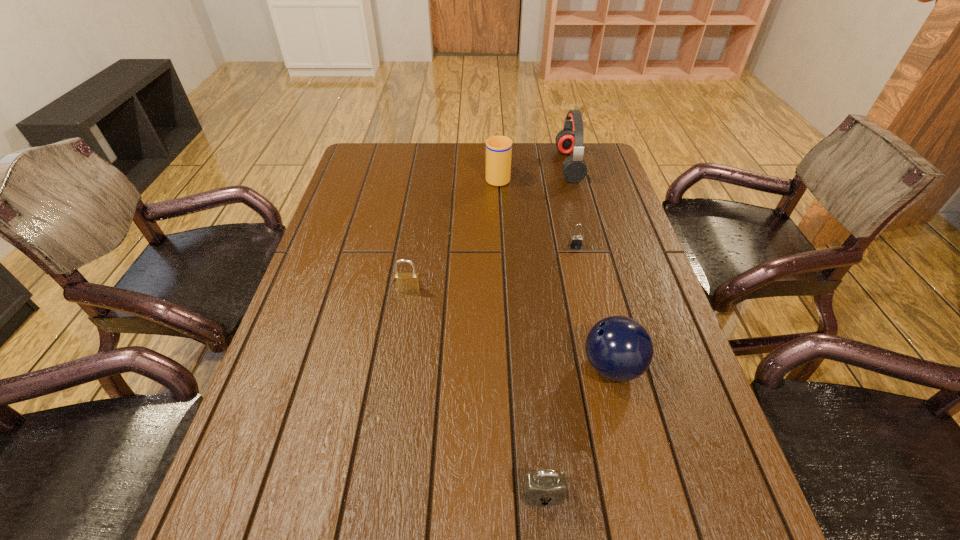
Where is `padlock that is the third closest to the bowling ball`? padlock that is the third closest to the bowling ball is located at coordinates (404, 282).

The width and height of the screenshot is (960, 540). In order to click on padlock that stands as the second closest to the fourth farthest object in this screenshot , I will do `click(546, 487)`.

I want to click on free space that satisfies the following two spatial constraints: 1. on the ear cups of the tallest object; 2. on the shackle of the rightmost padlock, so click(x=590, y=246).

You are a GUI agent. You are given a task and a screenshot of the screen. Output one action in this format:
    pyautogui.click(x=<x>, y=<y>)
    Task: Click on the vacant space that satisfies the following two spatial constraints: 1. on the ear cups of the tallest object; 2. at the front of the second padlock from right to left near the keyhole
    The image size is (960, 540).
    Given the screenshot: What is the action you would take?
    pyautogui.click(x=658, y=494)

I want to click on vacant area in the image that satisfies the following two spatial constraints: 1. on the ear cups of the earphone; 2. at the front of the nearest object near the keyhole, so click(658, 494).

I want to click on vacant point that satisfies the following two spatial constraints: 1. on the ear cups of the earphone; 2. on the front-facing side of the leftmost object, so click(602, 289).

You are a GUI agent. You are given a task and a screenshot of the screen. Output one action in this format:
    pyautogui.click(x=<x>, y=<y>)
    Task: Click on the blank space that satisfies the following two spatial constraints: 1. on the ear cups of the tallest object; 2. on the front-facing side of the second farthest padlock
    The width and height of the screenshot is (960, 540).
    Given the screenshot: What is the action you would take?
    pyautogui.click(x=602, y=289)

You are a GUI agent. You are given a task and a screenshot of the screen. Output one action in this format:
    pyautogui.click(x=<x>, y=<y>)
    Task: Click on the blank area in the image that satisfies the following two spatial constraints: 1. on the ear cups of the tallest object; 2. at the front of the nearest padlock near the keyhole
    The width and height of the screenshot is (960, 540).
    Given the screenshot: What is the action you would take?
    pyautogui.click(x=658, y=494)

This screenshot has height=540, width=960. I want to click on free space that satisfies the following two spatial constraints: 1. on the ear cups of the tallest object; 2. on the front-facing side of the second nearest padlock, so click(602, 289).